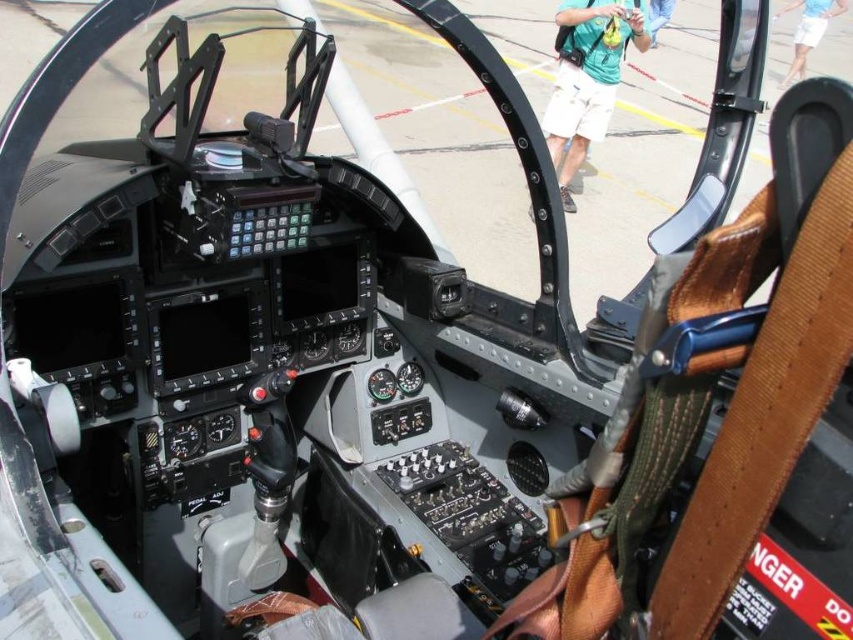
Is green fabric backpack at upper center positioned behind blue cotton shirt at upper right?

No, green fabric backpack at upper center is in front of blue cotton shirt at upper right.

Can you confirm if green fabric backpack at upper center is wider than blue cotton shirt at upper right?

No, green fabric backpack at upper center is not wider than blue cotton shirt at upper right.

At what (x,y) coordinates should I click in order to perform the action: click on green fabric backpack at upper center. Please return your answer as a coordinate pair (x, y). Image resolution: width=853 pixels, height=640 pixels. Looking at the image, I should click on (587, 77).

I want to click on green fabric backpack at upper center, so click(x=587, y=77).